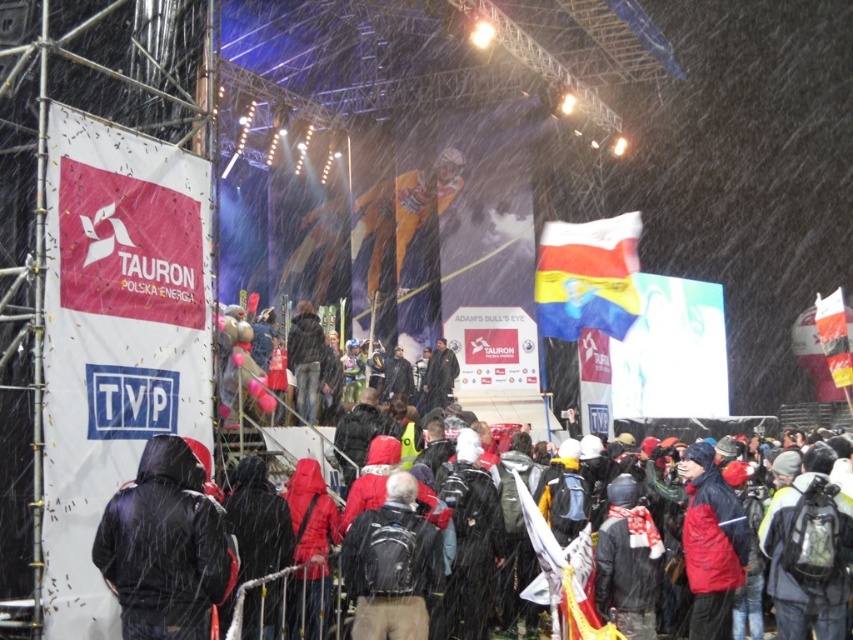
Which of these two, dark gray backpack at center or white fabric flag at right, stands taller?

white fabric flag at right is taller.

Who is lower down, dark gray backpack at center or white fabric flag at right?

Positioned lower is dark gray backpack at center.

Where is `dark gray backpack at center`? dark gray backpack at center is located at coordinates (392, 564).

Which is behind, point (427, 618) or point (537, 275)?

Point (537, 275)

Does dark gray backpack at center come in front of polished plastic flag at center?

Yes, dark gray backpack at center is in front of polished plastic flag at center.

Between point (424, 580) and point (611, 298), which one is positioned in front?

Positioned in front is point (424, 580).

At what (x,y) coordinates should I click in order to perform the action: click on dark gray backpack at center. Please return your answer as a coordinate pair (x, y). The width and height of the screenshot is (853, 640). Looking at the image, I should click on (392, 564).

Looking at this image, who is shorter, dark gray backpack at center or dark blue jacket at center?

With less height is dark gray backpack at center.

Can you confirm if dark gray backpack at center is positioned to the left of dark blue jacket at center?

Indeed, dark gray backpack at center is positioned on the left side of dark blue jacket at center.

Is point (439, 579) positioned behind point (260, 598)?

Yes, it is behind point (260, 598).

At what (x,y) coordinates should I click in order to perform the action: click on dark gray backpack at center. Please return your answer as a coordinate pair (x, y). Looking at the image, I should click on (392, 564).